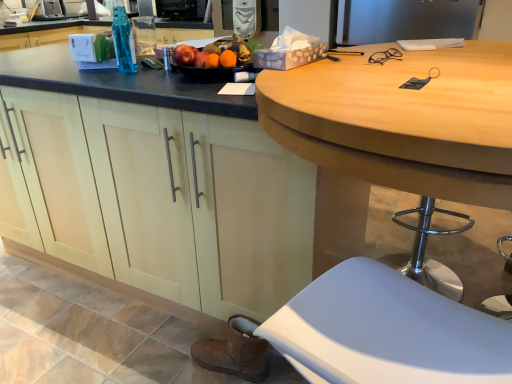
Locate an element on the screen. The image size is (512, 384). vacant space to the right of clear plastic glasses at upper right is located at coordinates (443, 62).